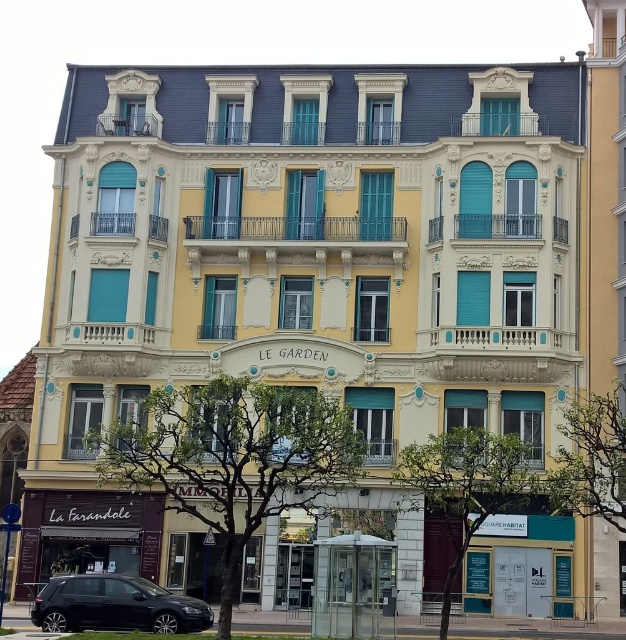
Question: Among these points, which one is nearest to the camera?

Choices:
 (A) (605, 307)
 (B) (80, 600)

Answer: (B)

Question: Considering the relative positions of yellow matte building at right and shiny black car at lower left in the image provided, where is yellow matte building at right located with respect to shiny black car at lower left?

Choices:
 (A) below
 (B) above

Answer: (B)

Question: Can you confirm if yellow matte building at right is positioned to the left of shiny black car at lower left?

Choices:
 (A) no
 (B) yes

Answer: (A)

Question: Which object is closer to the camera taking this photo?

Choices:
 (A) yellow matte building at right
 (B) shiny black car at lower left

Answer: (B)

Question: Is yellow matte building at right above shiny black car at lower left?

Choices:
 (A) yes
 (B) no

Answer: (A)